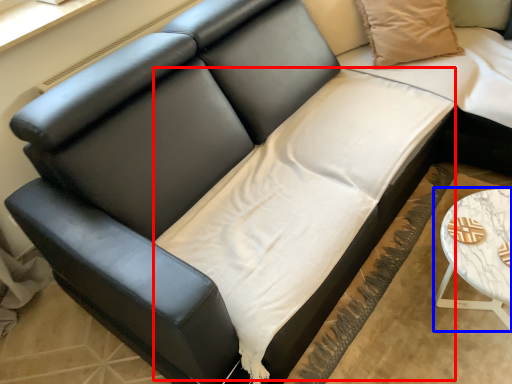
Question: Which object appears farthest to the camera in this image, sheet (highlighted by a red box) or table (highlighted by a blue box)?

Choices:
 (A) sheet
 (B) table

Answer: (B)